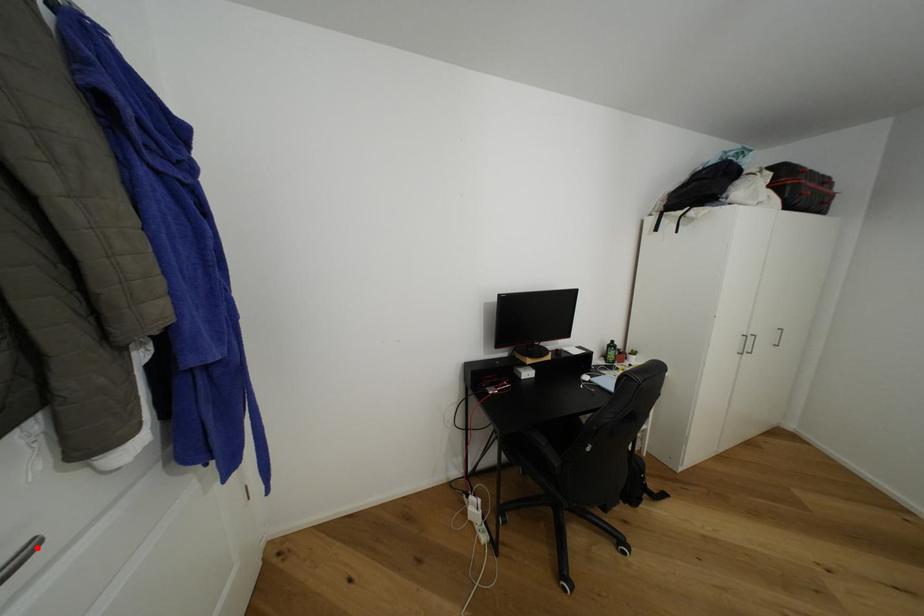
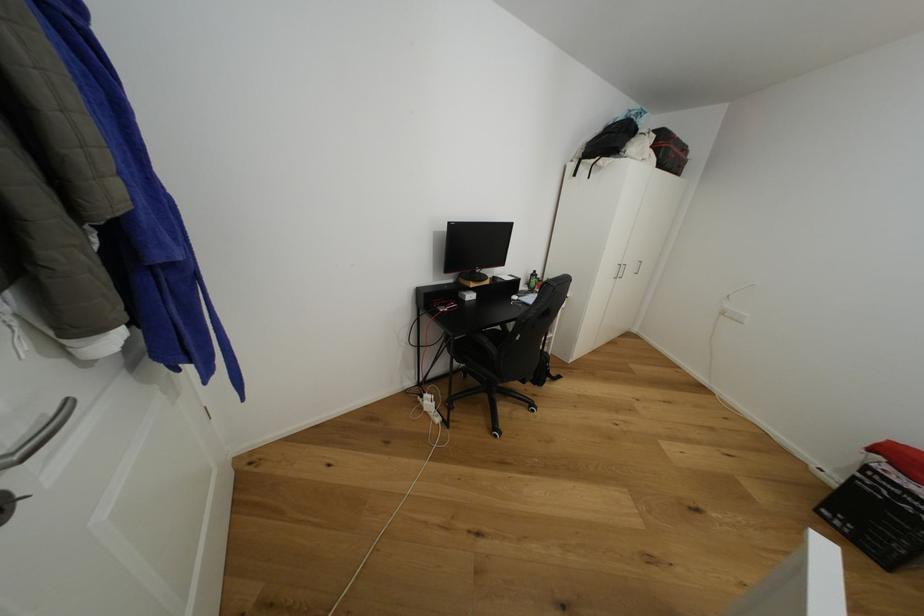
Where in the second image is the point corresponding to the highlighted location from the first image?

(75, 405)